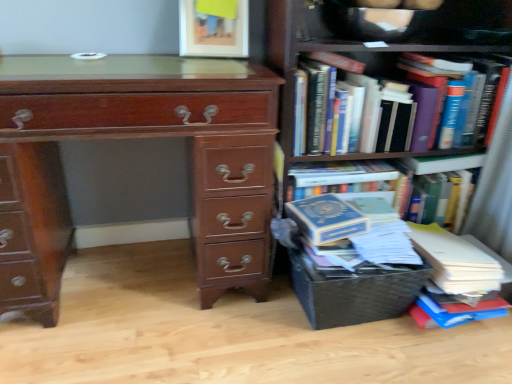
The image size is (512, 384). What do you see at coordinates (337, 53) in the screenshot?
I see `hardcover books at right` at bounding box center [337, 53].

In order to face hardcover books at upper right, the 1th book from the top, should I rotate leftwards or rightwards?

Turn right by 17.276 degrees to look at hardcover books at upper right, the 1th book from the top.

What do you see at coordinates (136, 137) in the screenshot? I see `shiny brown wooden chest of drawers at left` at bounding box center [136, 137].

What do you see at coordinates (370, 176) in the screenshot?
I see `blue hardcover book at right, positioned as the second book in top-to-bottom order` at bounding box center [370, 176].

Identify the location of woven brown crate at lower right. (353, 291).

At what (x,y) coordinates should I click in order to perform the action: click on hardcover books at right. Please return your answer as a coordinate pair (x, y). This screenshot has width=512, height=384. Looking at the image, I should click on (337, 53).

Considering the relative positions of hardcover books at upper right, the 1th book from the top, and hardcover books at right in the image provided, is hardcover books at upper right, the 1th book from the top, to the right of hardcover books at right from the viewer's perspective?

Incorrect, hardcover books at upper right, the 1th book from the top, is not on the right side of hardcover books at right.

Which object is wider, hardcover books at upper right, the 1th book from the top, or hardcover books at right?

hardcover books at right.

Is the surface of hardcover books at upper right, the 1th book from the top, in direct contact with hardcover books at right?

No.

Is hardcover books at right far away from shiny brown wooden chest of drawers at left?

Actually, hardcover books at right and shiny brown wooden chest of drawers at left are a little close together.

Does hardcover books at right appear on the right side of shiny brown wooden chest of drawers at left?

Indeed, hardcover books at right is positioned on the right side of shiny brown wooden chest of drawers at left.

Is hardcover books at right oriented away from shiny brown wooden chest of drawers at left?

No, hardcover books at right is not facing away from shiny brown wooden chest of drawers at left.

Consider the image. Can you confirm if blue hardcover book at right, positioned as the second book in top-to-bottom order, is positioned to the right of shiny brown wooden chest of drawers at left?

Correct, you'll find blue hardcover book at right, positioned as the second book in top-to-bottom order, to the right of shiny brown wooden chest of drawers at left.

Is there a large distance between blue hardcover book at right, positioned as the second book in top-to-bottom order, and shiny brown wooden chest of drawers at left?

No, blue hardcover book at right, positioned as the second book in top-to-bottom order, is in close proximity to shiny brown wooden chest of drawers at left.

Which object is further away from the camera taking this photo, blue hardcover book at right, positioned as the 1th book in bottom-to-top order, or shiny brown wooden chest of drawers at left?

blue hardcover book at right, positioned as the 1th book in bottom-to-top order, is behind.

Is point (386, 181) farther from camera compared to point (18, 116)?

Yes, it is behind point (18, 116).

Is shiny brown wooden chest of drawers at left positioned with its back to hardcover books at right?

No, shiny brown wooden chest of drawers at left is not facing the opposite direction of hardcover books at right.

Who is taller, shiny brown wooden chest of drawers at left or hardcover books at right?

With more height is hardcover books at right.

Considering the positions of objects shiny brown wooden chest of drawers at left and hardcover books at right in the image provided, who is more to the right, shiny brown wooden chest of drawers at left or hardcover books at right?

From the viewer's perspective, hardcover books at right appears more on the right side.

Consider the image. Considering the sizes of objects shiny brown wooden chest of drawers at left and hardcover books at right in the image provided, who is bigger, shiny brown wooden chest of drawers at left or hardcover books at right?

shiny brown wooden chest of drawers at left is bigger.

Can you confirm if shiny brown wooden chest of drawers at left is positioned to the left of blue hardcover book at right, positioned as the 1th book in bottom-to-top order?

Yes, shiny brown wooden chest of drawers at left is to the left of blue hardcover book at right, positioned as the 1th book in bottom-to-top order.

How many degrees apart are the facing directions of shiny brown wooden chest of drawers at left and blue hardcover book at right, positioned as the 1th book in bottom-to-top order?

shiny brown wooden chest of drawers at left and blue hardcover book at right, positioned as the 1th book in bottom-to-top order, are facing 1.59 degrees away from each other.

Measure the distance between shiny brown wooden chest of drawers at left and blue hardcover book at right, positioned as the second book in top-to-bottom order.

shiny brown wooden chest of drawers at left is 53.94 centimeters from blue hardcover book at right, positioned as the second book in top-to-bottom order.

Locate an element on the screen. the chest of drawers above the blue hardcover book at right, positioned as the second book in top-to-bottom order (from the image's perspective) is located at coordinates pos(136,137).

Who is shorter, hardcover books at upper right, which ranks as the second book in bottom-to-top order, or blue hardcover book at right, positioned as the 1th book in bottom-to-top order?

hardcover books at upper right, which ranks as the second book in bottom-to-top order.

Is point (397, 125) closer to viewer compared to point (352, 165)?

Yes.

From the image's perspective, is hardcover books at upper right, the 1th book from the top, on top of blue hardcover book at right, positioned as the 1th book in bottom-to-top order?

Yes, from the image's perspective, hardcover books at upper right, the 1th book from the top, is above blue hardcover book at right, positioned as the 1th book in bottom-to-top order.

Considering the positions of objects woven brown crate at lower right and hardcover books at right in the image provided, who is more to the right, woven brown crate at lower right or hardcover books at right?

From the viewer's perspective, hardcover books at right appears more on the right side.

Which of these two, woven brown crate at lower right or hardcover books at right, is wider?

Wider between the two is hardcover books at right.

From a real-world perspective, is woven brown crate at lower right above or below hardcover books at right?

woven brown crate at lower right is below hardcover books at right.

In the image, there is a hardcover books at upper right, which ranks as the second book in bottom-to-top order. Where is `bookcase below it (from the image's perspective)`? bookcase below it (from the image's perspective) is located at coordinates (337, 53).

You are a GUI agent. You are given a task and a screenshot of the screen. Output one action in this format:
    pyautogui.click(x=<x>, y=<y>)
    Task: Click on the chest of drawers located underneath the hardcover books at right (from a real-world perspective)
    The image size is (512, 384).
    Given the screenshot: What is the action you would take?
    pyautogui.click(x=136, y=137)

Which object lies nearer to the anchor point hardcover books at upper right, which ranks as the second book in bottom-to-top order, hardcover books at right or blue hardcover book at right, positioned as the 1th book in bottom-to-top order?

hardcover books at right.

Estimate the real-world distances between objects in this image. Which object is closer to hardcover books at right, shiny brown wooden chest of drawers at left or hardcover books at upper right, the 1th book from the top?

hardcover books at upper right, the 1th book from the top.

Based on their spatial positions, is woven brown crate at lower right or hardcover books at right closer to hardcover books at upper right, the 1th book from the top?

hardcover books at right.

Looking at the image, which one is located closer to hardcover books at upper right, the 1th book from the top, shiny brown wooden chest of drawers at left or blue hardcover book at right, positioned as the second book in top-to-bottom order?

The object closer to hardcover books at upper right, the 1th book from the top, is blue hardcover book at right, positioned as the second book in top-to-bottom order.

When comparing their distances from hardcover books at upper right, the 1th book from the top, does hardcover books at right or shiny brown wooden chest of drawers at left seem closer?

hardcover books at right is closer to hardcover books at upper right, the 1th book from the top.

When comparing their distances from woven brown crate at lower right, does hardcover books at right or hardcover books at upper right, the 1th book from the top, seem further?

hardcover books at upper right, the 1th book from the top.

Which object lies further to the anchor point woven brown crate at lower right, shiny brown wooden chest of drawers at left or hardcover books at upper right, which ranks as the second book in bottom-to-top order?

hardcover books at upper right, which ranks as the second book in bottom-to-top order.

Based on their spatial positions, is hardcover books at right or blue hardcover book at right, positioned as the 1th book in bottom-to-top order, further from woven brown crate at lower right?

Based on the image, blue hardcover book at right, positioned as the 1th book in bottom-to-top order, appears to be further to woven brown crate at lower right.

I want to click on crate between shiny brown wooden chest of drawers at left and hardcover books at right, so click(x=353, y=291).

Identify the location of book that lies between hardcover books at right and woven brown crate at lower right from top to bottom. (370, 176).

I want to click on crate located between shiny brown wooden chest of drawers at left and hardcover books at upper right, the 1th book from the top, in the left-right direction, so click(353, 291).

The height and width of the screenshot is (384, 512). I want to click on crate between shiny brown wooden chest of drawers at left and blue hardcover book at right, positioned as the second book in top-to-bottom order, in the horizontal direction, so click(353, 291).